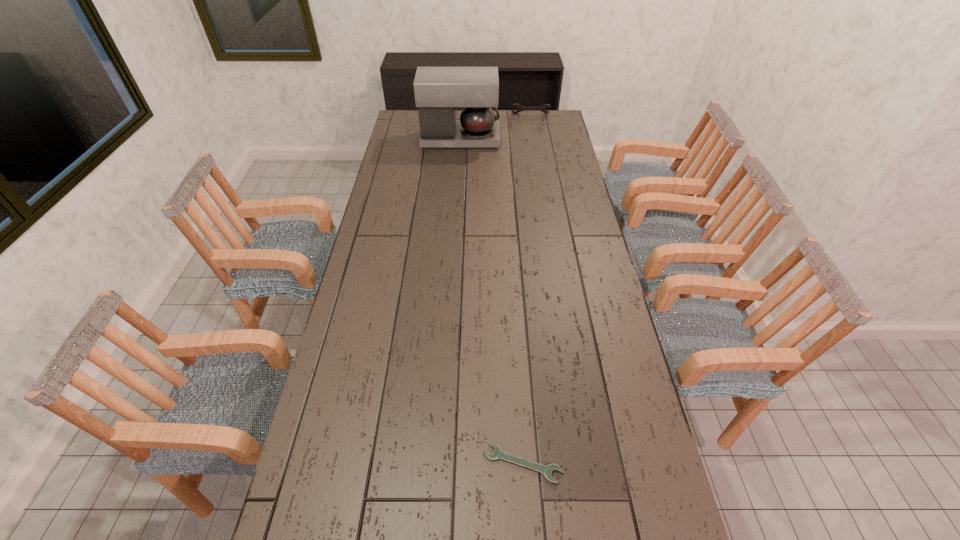
This screenshot has width=960, height=540. Find the location of `blank region between the second shortest object and the nearer wrench`. blank region between the second shortest object and the nearer wrench is located at coordinates (527, 289).

Locate an element on the screen. The width and height of the screenshot is (960, 540). vacant region between the shorter wrench and the farthest object is located at coordinates (527, 289).

Identify the location of unoccupied position between the nearest object and the second farthest object. Image resolution: width=960 pixels, height=540 pixels. (492, 302).

Find the location of a particular element. This screenshot has height=540, width=960. vacant point located between the farthest object and the shortest object is located at coordinates (527, 289).

This screenshot has height=540, width=960. What are the coordinates of `vacant space in between the shorter wrench and the second farthest object` in the screenshot? It's located at (492, 302).

Where is `vacant area that lies between the taller wrench and the shorter wrench`? This screenshot has height=540, width=960. vacant area that lies between the taller wrench and the shorter wrench is located at coordinates click(527, 289).

Select which object appears as the closest to the tallest object. Please provide its 2D coordinates. Your answer should be formatted as a tuple, i.e. [(x, y)], where the tuple contains the x and y coordinates of a point satisfying the conditions above.

[(520, 108)]

Find the location of a particular element. This screenshot has width=960, height=540. object that is the second closest to the taller wrench is located at coordinates (546, 470).

Identify the location of vacant area that satisfies the following two spatial constraints: 1. on the carafe side of the shorter wrench; 2. on the right side of the coffee maker. (440, 464).

Find the location of `vacant position in the image that satisfies the following two spatial constraints: 1. on the carafe side of the nearer wrench; 2. on the right side of the second nearest object`. vacant position in the image that satisfies the following two spatial constraints: 1. on the carafe side of the nearer wrench; 2. on the right side of the second nearest object is located at coordinates (440, 464).